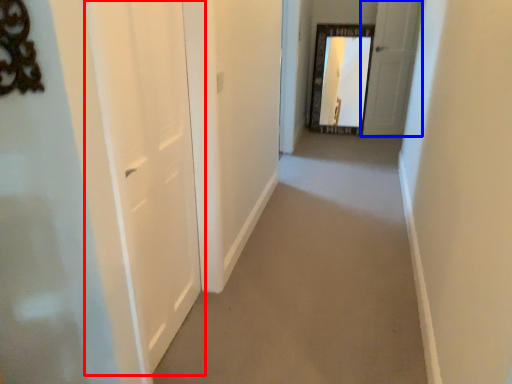
Question: Among these objects, which one is nearest to the camera, door (highlighted by a red box) or door (highlighted by a blue box)?

Choices:
 (A) door
 (B) door

Answer: (A)